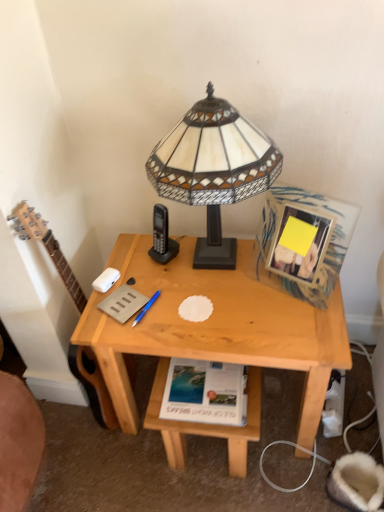
Identify the location of vacant space in front of wooden acoustic guitar at left. The width and height of the screenshot is (384, 512). (102, 466).